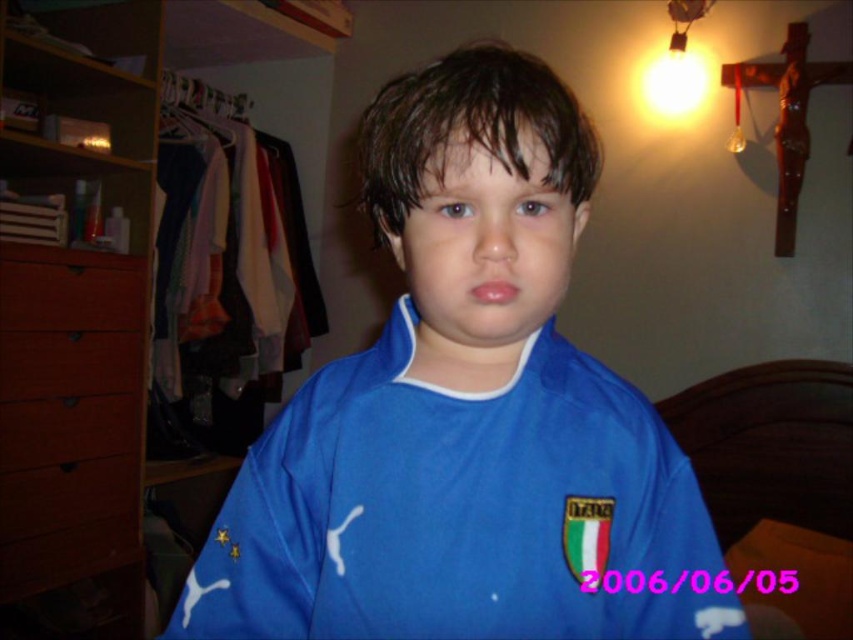
Is brown wood dresser at left further to camera compared to brown wood drawer at left?

Yes, it is.

Is brown wood dresser at left bigger than brown wood drawer at left?

Yes.

You are a GUI agent. You are given a task and a screenshot of the screen. Output one action in this format:
    pyautogui.click(x=<x>, y=<y>)
    Task: Click on the brown wood dresser at left
    
    Given the screenshot: What is the action you would take?
    pyautogui.click(x=78, y=330)

Can you confirm if blue fabric shirt at center is shorter than brown wood drawer at left?

In fact, blue fabric shirt at center may be taller than brown wood drawer at left.

Which is more to the right, blue fabric shirt at center or brown wood drawer at left?

blue fabric shirt at center is more to the right.

Image resolution: width=853 pixels, height=640 pixels. I want to click on blue fabric shirt at center, so click(x=466, y=413).

What are the coordinates of `blue fabric shirt at center` in the screenshot? It's located at (466, 413).

Does blue fabric shirt at center lie behind brown wood dresser at left?

No.

Who is more forward, (575, 365) or (120, 540)?

Point (575, 365)

I want to click on blue fabric shirt at center, so click(466, 413).